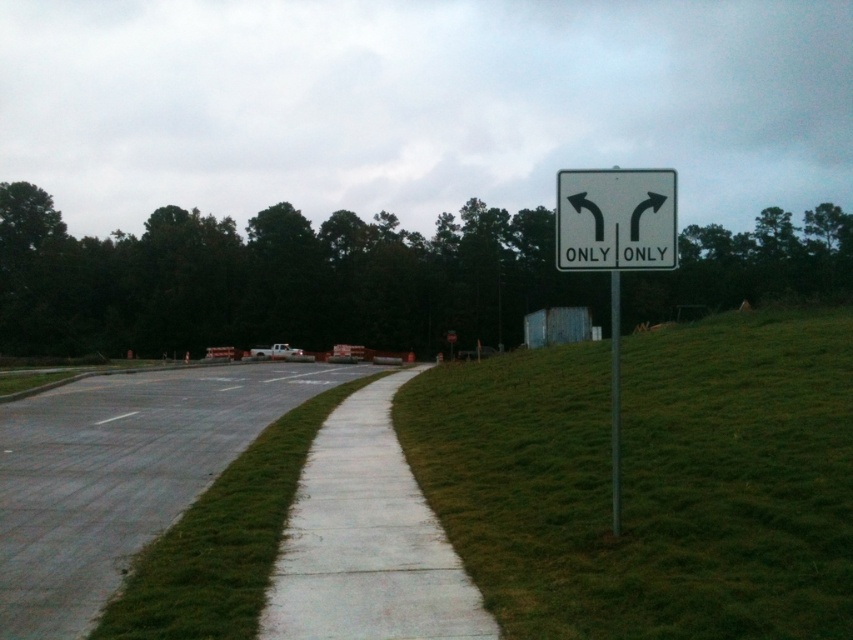
Can you confirm if gray asphalt pavement at lower left is positioned below white metallic sign at right?

Correct, gray asphalt pavement at lower left is located below white metallic sign at right.

Does gray asphalt pavement at lower left have a lesser height compared to white metallic sign at right?

Indeed, gray asphalt pavement at lower left has a lesser height compared to white metallic sign at right.

Locate an element on the screen. The height and width of the screenshot is (640, 853). gray asphalt pavement at lower left is located at coordinates (120, 476).

Which is below, gray asphalt pavement at lower left or metallic pole at right?

gray asphalt pavement at lower left is lower down.

Is gray asphalt pavement at lower left bigger than metallic pole at right?

No, gray asphalt pavement at lower left is not bigger than metallic pole at right.

Is point (33, 513) farther from viewer compared to point (612, 380)?

No, (33, 513) is in front of (612, 380).

Where is `gray asphalt pavement at lower left`? gray asphalt pavement at lower left is located at coordinates (120, 476).

Is white concrete sidewalk at center to the right of metallic pole at right from the viewer's perspective?

No, white concrete sidewalk at center is not to the right of metallic pole at right.

Can you confirm if white concrete sidewalk at center is positioned above metallic pole at right?

No, white concrete sidewalk at center is not above metallic pole at right.

Is point (416, 371) closer to camera compared to point (612, 442)?

No, (416, 371) is behind (612, 442).

What are the coordinates of `white concrete sidewalk at center` in the screenshot? It's located at (367, 540).